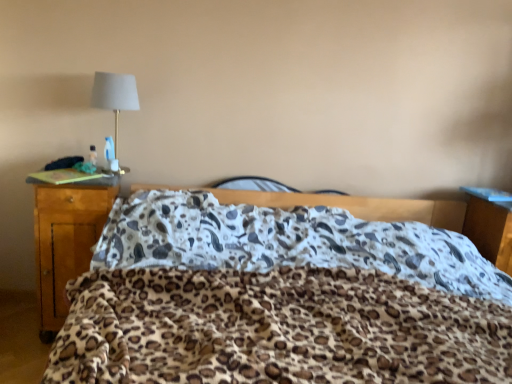
Question: Is wooden desk at left shorter than leopard print blanket at center?

Choices:
 (A) yes
 (B) no

Answer: (B)

Question: From the image's perspective, is wooden desk at left located above leopard print blanket at center?

Choices:
 (A) yes
 (B) no

Answer: (A)

Question: Is wooden desk at left facing away from leopard print blanket at center?

Choices:
 (A) yes
 (B) no

Answer: (B)

Question: Is wooden desk at left at the right side of leopard print blanket at center?

Choices:
 (A) yes
 (B) no

Answer: (B)

Question: From a real-world perspective, is wooden desk at left located beneath leopard print blanket at center?

Choices:
 (A) no
 (B) yes

Answer: (A)

Question: Considering the relative positions of wooden desk at left and leopard print blanket at center in the image provided, is wooden desk at left in front of leopard print blanket at center?

Choices:
 (A) no
 (B) yes

Answer: (A)

Question: Would you say wooden nightstand at right is a long distance from leopard print blanket at center?

Choices:
 (A) yes
 (B) no

Answer: (B)

Question: Considering the relative sizes of wooden nightstand at right and leopard print blanket at center in the image provided, is wooden nightstand at right wider than leopard print blanket at center?

Choices:
 (A) no
 (B) yes

Answer: (A)

Question: Does wooden nightstand at right come behind leopard print blanket at center?

Choices:
 (A) yes
 (B) no

Answer: (A)

Question: From a real-world perspective, does wooden nightstand at right sit lower than leopard print blanket at center?

Choices:
 (A) no
 (B) yes

Answer: (A)

Question: Considering the relative sizes of wooden nightstand at right and leopard print blanket at center in the image provided, is wooden nightstand at right shorter than leopard print blanket at center?

Choices:
 (A) no
 (B) yes

Answer: (B)

Question: From a real-world perspective, is wooden nightstand at right located higher than leopard print blanket at center?

Choices:
 (A) no
 (B) yes

Answer: (B)

Question: Is matte gold lamp at upper left thinner than wooden nightstand at right?

Choices:
 (A) no
 (B) yes

Answer: (B)